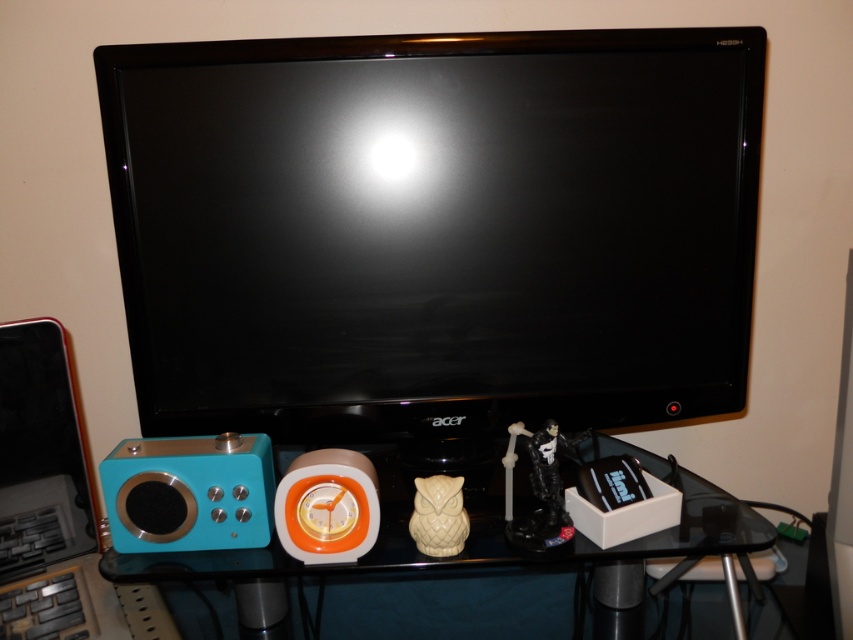
Based on the scene description, where is the black glossy monitor at center located in terms of its 2D coordinates?

The black glossy monitor at center is located at the 2D coordinates of point (434, 228).

You are organizing items on the desk and want to place a new item between the black glossy monitor at center and the translucent glass shelf at center. Based on their widths, which object should be placed closer to the edge of the desk to ensure the new item fits?

The translucent glass shelf at center is narrower than the black glossy monitor at center. To fit the new item between them, place the translucent glass shelf at center closer to the edge since it has a smaller width.

Based on the scene description, what is the 2D coordinate position of the black glossy monitor at center?

The black glossy monitor at center is located at the 2D coordinate point of (434, 228).